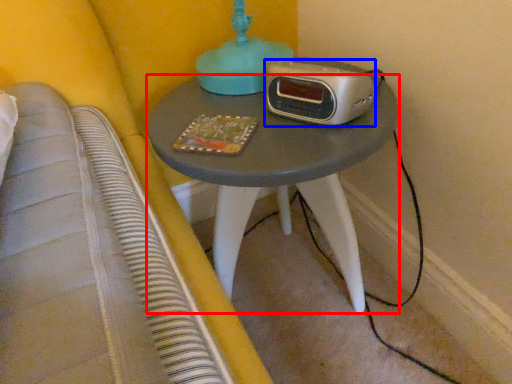
Question: Which object is further to the camera taking this photo, nightstand (highlighted by a red box) or stereo (highlighted by a blue box)?

Choices:
 (A) nightstand
 (B) stereo

Answer: (B)